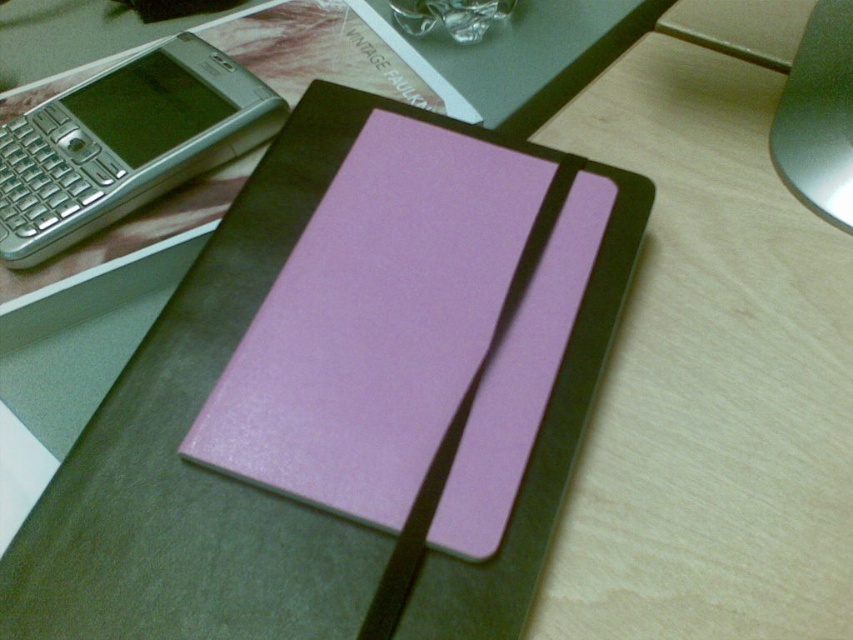
Question: Observing the image, what is the correct spatial positioning of lavender matte notepad at center in reference to silver metallic smartphone at upper left?

Choices:
 (A) right
 (B) left

Answer: (A)

Question: In this image, where is lavender matte notepad at center located relative to silver metallic smartphone at upper left?

Choices:
 (A) below
 (B) above

Answer: (A)

Question: Among these points, which one is farthest from the camera?

Choices:
 (A) tap(505, 307)
 (B) tap(122, 198)

Answer: (B)

Question: Is lavender matte notepad at center above silver metallic smartphone at upper left?

Choices:
 (A) yes
 (B) no

Answer: (B)

Question: Which point is farther to the camera?

Choices:
 (A) (111, 184)
 (B) (437, 317)

Answer: (A)